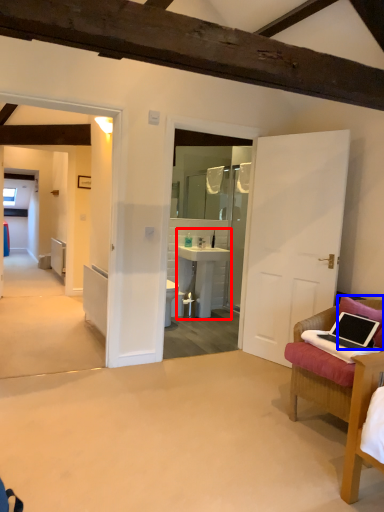
Question: Among these objects, which one is farthest to the camera, sink (highlighted by a red box) or pillow (highlighted by a blue box)?

Choices:
 (A) sink
 (B) pillow

Answer: (A)